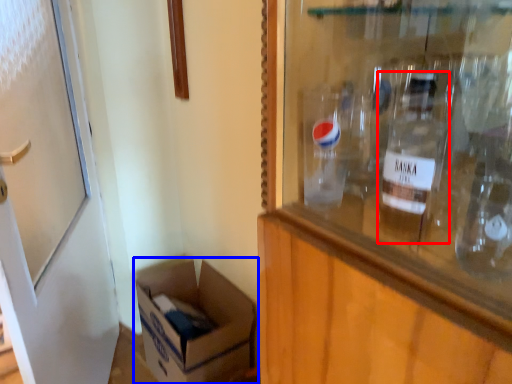
Question: Among these objects, which one is nearest to the camera, bottle (highlighted by a red box) or box (highlighted by a blue box)?

Choices:
 (A) bottle
 (B) box

Answer: (A)